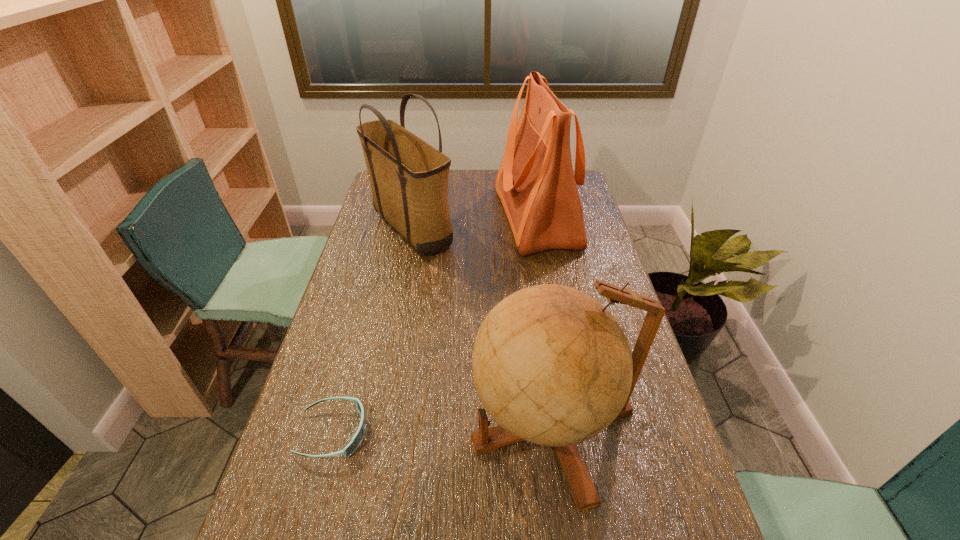
Image resolution: width=960 pixels, height=540 pixels. In order to click on object positioned at the far edge in this screenshot , I will do `click(537, 187)`.

I want to click on tote bag located at the left edge, so tap(409, 178).

The width and height of the screenshot is (960, 540). Identify the location of goggles that is at the left edge. (356, 440).

Locate an element on the screen. Image resolution: width=960 pixels, height=540 pixels. shopping bag situated at the right edge is located at coordinates (537, 187).

At what (x,y) coordinates should I click in order to perform the action: click on globe present at the right edge. Please return your answer as a coordinate pair (x, y). Looking at the image, I should click on (551, 365).

Locate an element on the screen. object that is positioned at the far right corner is located at coordinates (537, 187).

In the image, there is a desktop. Find the location of `blank space at the far edge`. blank space at the far edge is located at coordinates (489, 177).

Find the location of `vacant space at the left edge of the desktop`. vacant space at the left edge of the desktop is located at coordinates (341, 343).

At what (x,y) coordinates should I click in order to perform the action: click on vacant point located between the goggles and the tote bag. Please return your answer as a coordinate pair (x, y). This screenshot has width=960, height=540. Looking at the image, I should click on (372, 330).

This screenshot has width=960, height=540. What are the coordinates of `vacant area between the tote bag and the shopping bag` in the screenshot? It's located at (473, 222).